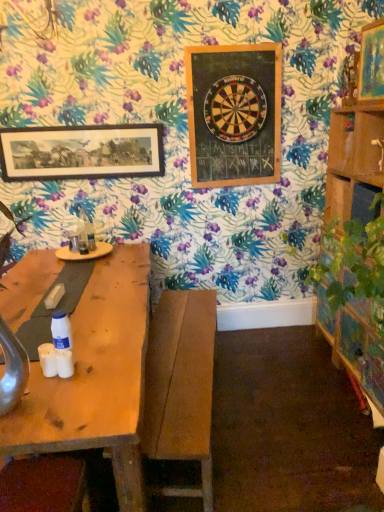
Locate an element on the screen. This screenshot has width=384, height=512. free space above wooden dartboard at upper center, which is the second picture frame in left-to-right order (from a real-world perspective) is located at coordinates (232, 46).